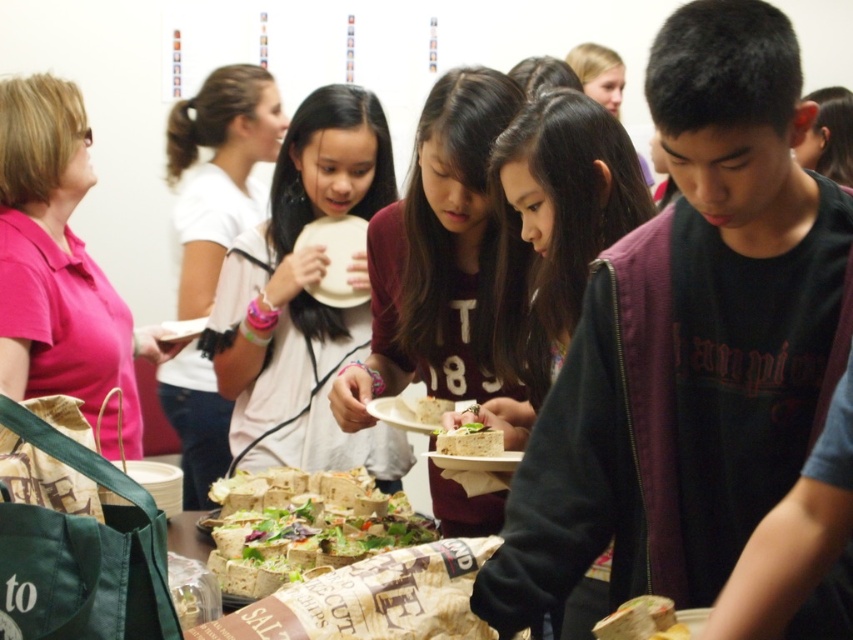
Is white matte paper plate at upper center closer to the viewer compared to green leafy salad at center?

No, white matte paper plate at upper center is behind green leafy salad at center.

Which is above, white matte paper plate at upper center or green leafy salad at center?

Positioned higher is white matte paper plate at upper center.

Find the location of a particular element. Image resolution: width=853 pixels, height=640 pixels. white matte paper plate at upper center is located at coordinates (218, 172).

Identify the location of white matte paper plate at upper center. This screenshot has width=853, height=640. (218, 172).

Can you confirm if matte brown sweater at center is thinner than crusty bread at center?

Indeed, matte brown sweater at center has a lesser width compared to crusty bread at center.

Does matte brown sweater at center appear on the left side of crusty bread at center?

In fact, matte brown sweater at center is to the right of crusty bread at center.

Is point (548, 196) behind point (364, 500)?

No, it is in front of (364, 500).

Identify the location of matte brown sweater at center. The image size is (853, 640). (555, 225).

Where is `pink fabric shirt at left`? This screenshot has width=853, height=640. pink fabric shirt at left is located at coordinates (61, 268).

This screenshot has height=640, width=853. Describe the element at coordinates (61, 268) in the screenshot. I see `pink fabric shirt at left` at that location.

This screenshot has width=853, height=640. Describe the element at coordinates (61, 268) in the screenshot. I see `pink fabric shirt at left` at that location.

Locate an element on the screen. pink fabric shirt at left is located at coordinates (61, 268).